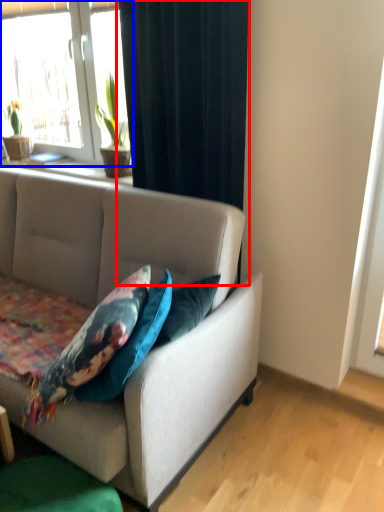
Question: Which of the following is the closest to the observer, curtain (highlighted by a red box) or window (highlighted by a blue box)?

Choices:
 (A) curtain
 (B) window

Answer: (A)